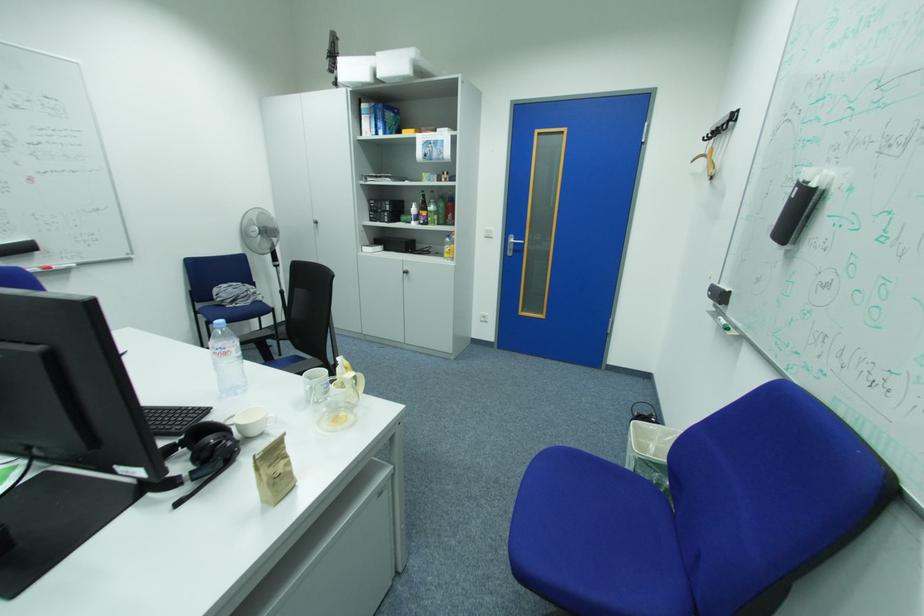
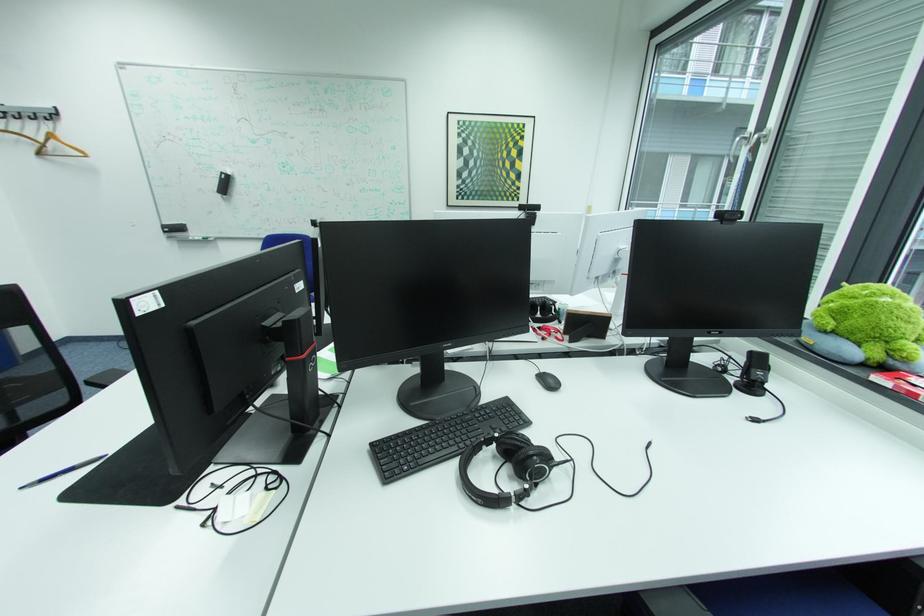
Question: I am providing you with two images of the same scene from different viewpoints. Which of the following objects are not visible in image2?

Choices:
 (A) whiteboard marker
 (B) yellow hanging toy
 (C) glass pitcher handle
 (D) black keyboard

Answer: (C)